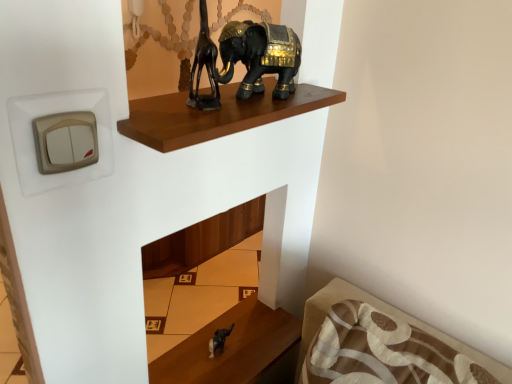
Identify the location of vacant area located to the right-hand side of black glossy elephant at upper center. (311, 97).